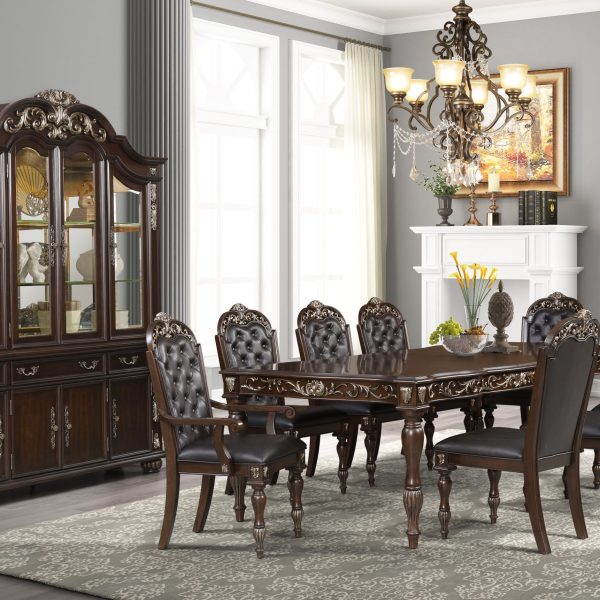
At what (x,y) coordinates should I click in order to perform the action: click on wood furniture. Please return your answer as a coordinate pair (x, y). Looking at the image, I should click on (107, 403), (214, 441), (414, 378), (260, 335), (331, 326), (384, 323), (549, 418), (588, 424).